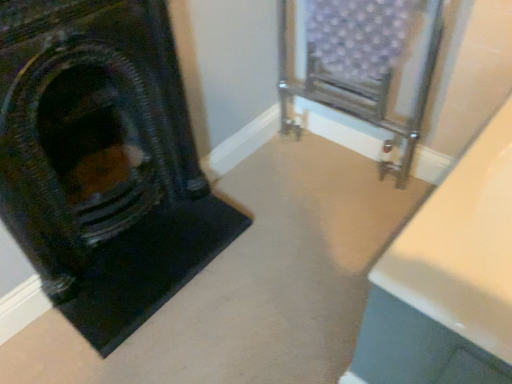
The height and width of the screenshot is (384, 512). I want to click on vacant area to the left of metallic radiator at center, so click(x=278, y=167).